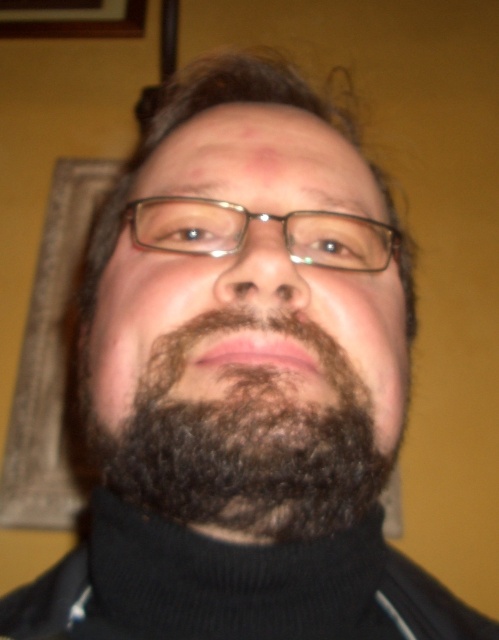
You are a fashion designer trying to create a new accessory that can be worn with the black knitted polo neck at center and the clear plastic glasses at center. Based on their sizes, which item should you design the accessory to attach to?

The black knitted polo neck at center is wider than the clear plastic glasses at center, so the accessory should be designed to attach to the black knitted polo neck at center.

You are a photographer trying to frame a portrait. The subject has a dark brown curly beard at center and a black knitted polo neck at center. If you want to focus on the beard, should you adjust your camera to capture more width on the left side of the frame?

The dark brown curly beard at center might be wider than the black knitted polo neck at center, so adjusting the camera to capture more width on the left side could help emphasize the beard.

You are a photographer adjusting the focus on your camera. You need to ensure that both the dark brown curly beard at center and the clear plastic glasses at center are in focus. Given that the depth of field can only cover 3.5 inches, will both objects be in focus?

The dark brown curly beard at center and the clear plastic glasses at center are 3.76 inches apart from each other. Since the depth of field can only cover 3.5 inches, they are slightly out of the required range, so both objects cannot be in focus simultaneously.